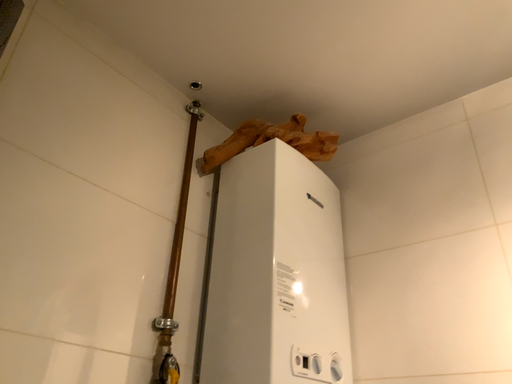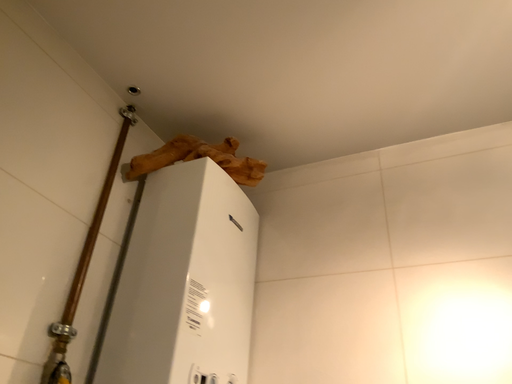
Question: Which way did the camera rotate in the video?

Choices:
 (A) rotated right
 (B) rotated left

Answer: (A)